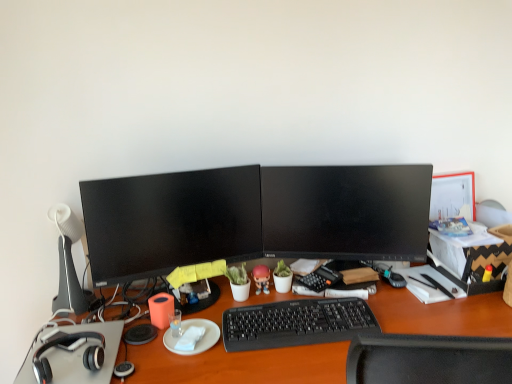
This screenshot has width=512, height=384. What are the coordinates of `vacant area that lies to the right of white paper at center` in the screenshot? It's located at (244, 348).